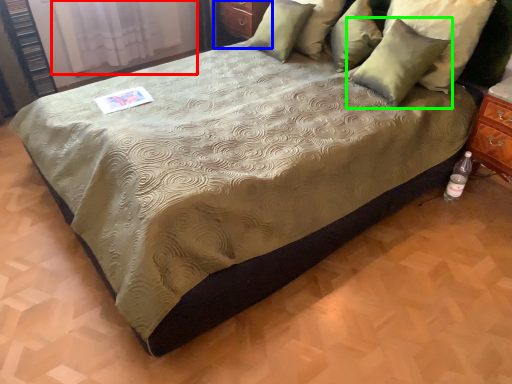
Question: Which object is the farthest from curtain (highlighted by a red box)? Choose among these: dresser (highlighted by a blue box) or pillow (highlighted by a green box).

Choices:
 (A) dresser
 (B) pillow

Answer: (B)